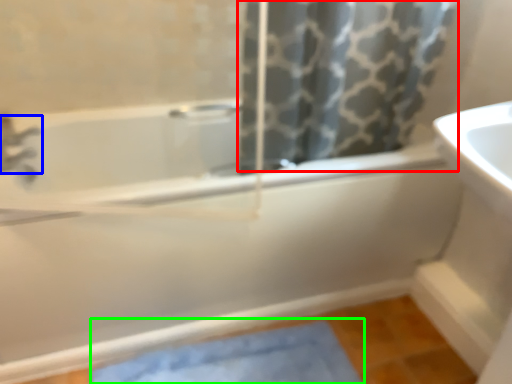
Question: Which object is the closest to the shower curtain (highlighted by a red box)? Choose among these: tap (highlighted by a blue box) or bath mat (highlighted by a green box).

Choices:
 (A) tap
 (B) bath mat

Answer: (B)